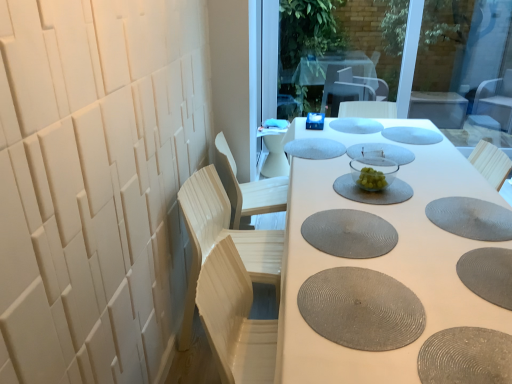
Identify the location of vacant space to the left of gray textured placemat at lower right, which is the fifth manhole cover from front to back. (399, 219).